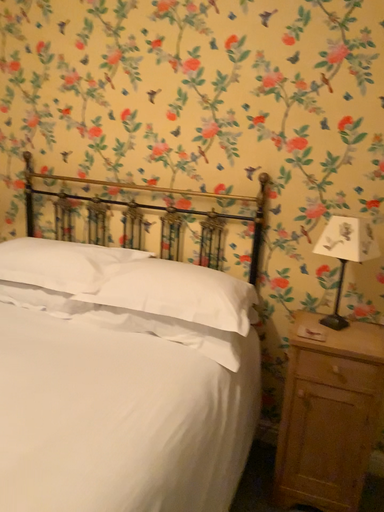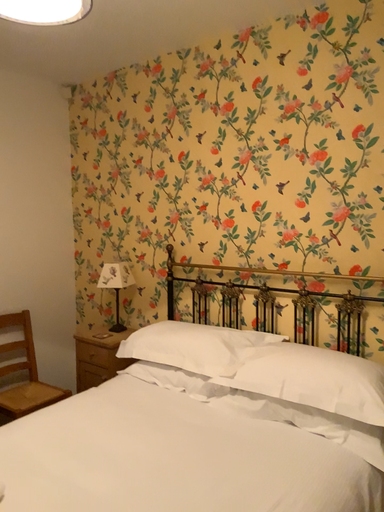
Question: Which way did the camera rotate in the video?

Choices:
 (A) rotated downward
 (B) rotated upward

Answer: (B)